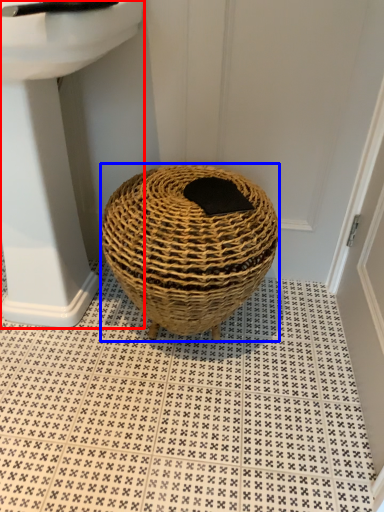
Question: Among these objects, which one is farthest to the camera, sink (highlighted by a red box) or basket (highlighted by a blue box)?

Choices:
 (A) sink
 (B) basket

Answer: (B)